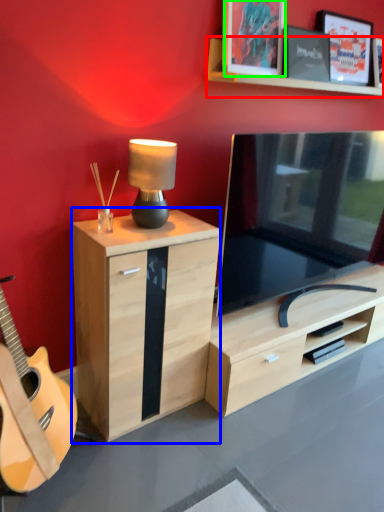
Question: Which object is the farthest from shelf (highlighted by a red box)? Choose among these: chest of drawers (highlighted by a blue box) or picture frame (highlighted by a green box).

Choices:
 (A) chest of drawers
 (B) picture frame

Answer: (A)